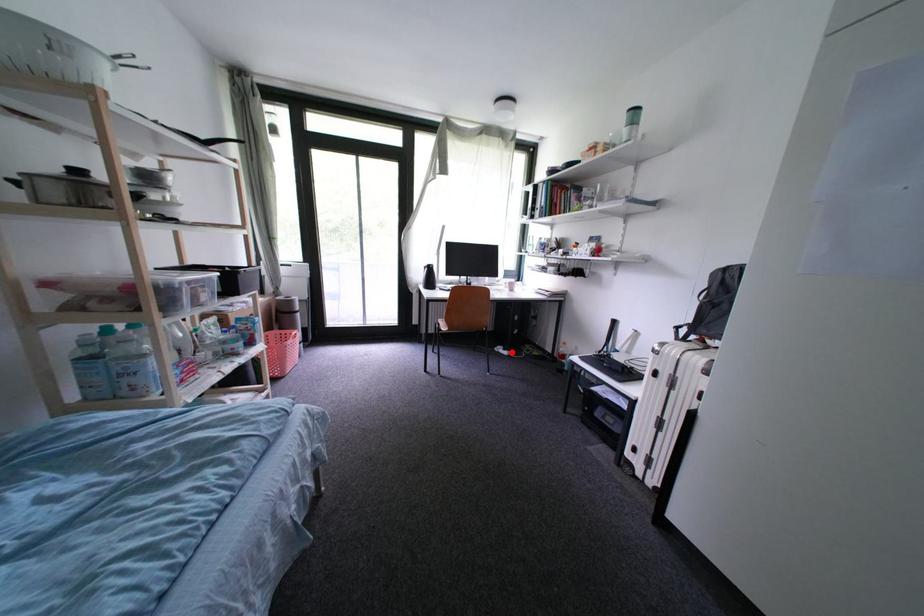
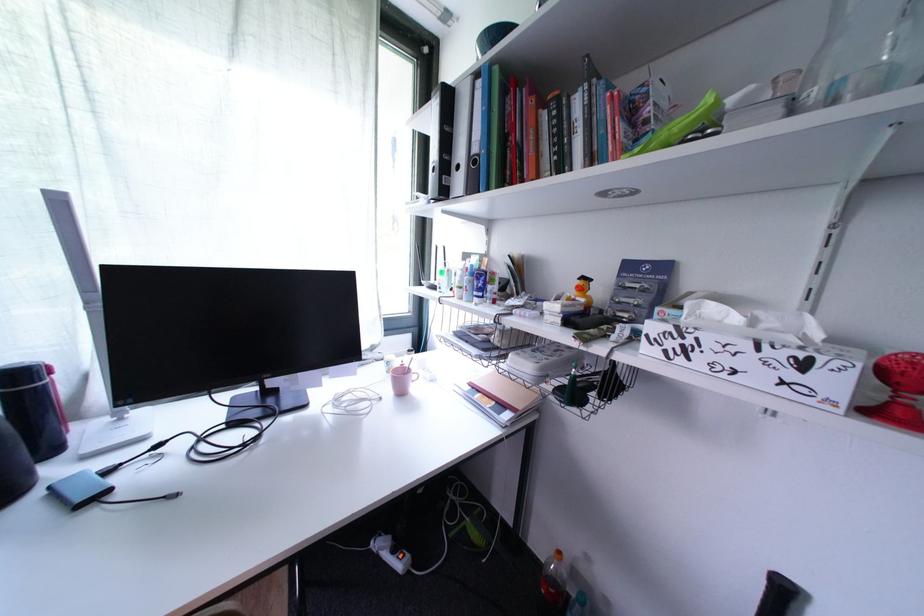
Question: I am providing you with two images of the same scene from different viewpoints. Given a red point in image1, look at the same physical point in image2. Is it:

Choices:
 (A) Closer to the viewpoint
 (B) Farther from the viewpoint

Answer: (A)